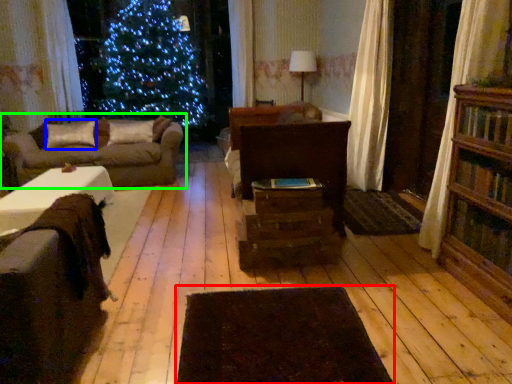
Question: Considering the real-world distances, which object is closest to wide (highlighted by a red box)? pillow (highlighted by a blue box) or studio couch (highlighted by a green box).

Choices:
 (A) pillow
 (B) studio couch

Answer: (B)